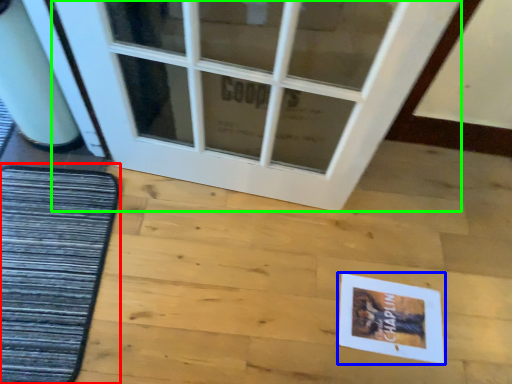
Question: Which object is positioned closest to mat (highlighted by a red box)? Select from postcard (highlighted by a blue box) and door (highlighted by a green box).

Choices:
 (A) postcard
 (B) door

Answer: (B)